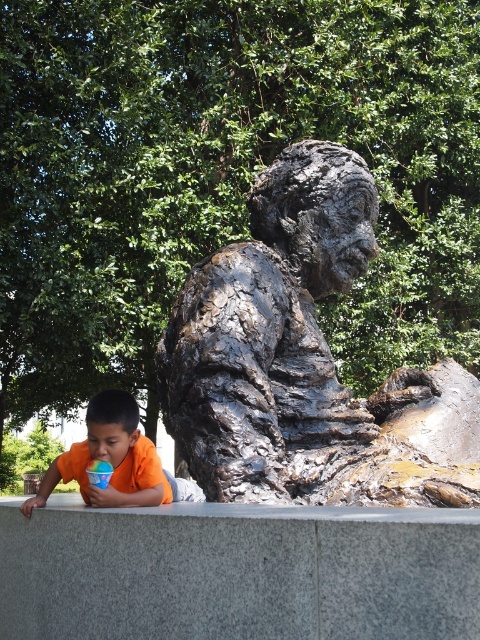
Between point (46, 576) and point (55, 476), which one is positioned behind?

The point (55, 476) is more distant.

Is gray granite ledge at center shorter than orange t-shirt at lower left?

In fact, gray granite ledge at center may be taller than orange t-shirt at lower left.

Between point (334, 554) and point (131, 497), which one is positioned in front?

Point (334, 554) is in front.

Locate an element on the screen. The width and height of the screenshot is (480, 640). gray granite ledge at center is located at coordinates (x=239, y=572).

Can you confirm if orange t-shirt at lower left is positioned to the left of translucent plastic cup at lower left?

Indeed, orange t-shirt at lower left is positioned on the left side of translucent plastic cup at lower left.

Image resolution: width=480 pixels, height=640 pixels. What are the coordinates of `orange t-shirt at lower left` in the screenshot? It's located at (109, 458).

The height and width of the screenshot is (640, 480). Identify the location of orange t-shirt at lower left. (109, 458).

Can you confirm if gray granite ledge at center is positioned below translucent plastic cup at lower left?

Indeed, gray granite ledge at center is positioned under translucent plastic cup at lower left.

Can you confirm if gray granite ledge at center is smaller than translucent plastic cup at lower left?

Incorrect, gray granite ledge at center is not smaller in size than translucent plastic cup at lower left.

Which is in front, point (330, 592) or point (104, 465)?

Point (330, 592) is in front.

Identify the location of gray granite ledge at center. This screenshot has height=640, width=480. (239, 572).